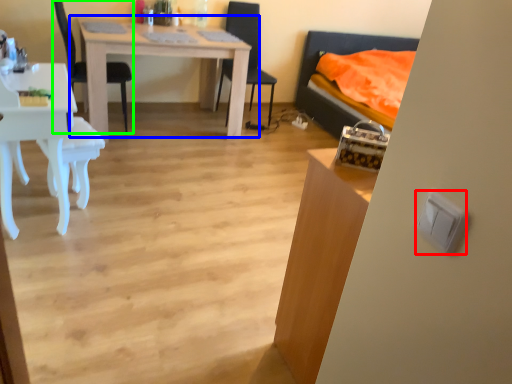
Question: Estimate the real-world distances between objects in this image. Which object is closer to light switch (highlighted by a red box), table (highlighted by a blue box) or chair (highlighted by a green box)?

Choices:
 (A) table
 (B) chair

Answer: (A)